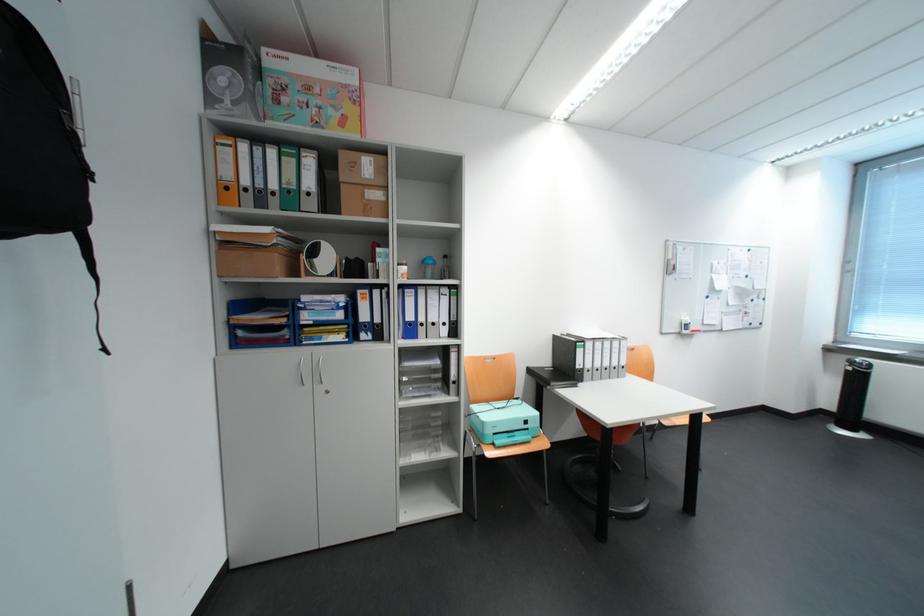
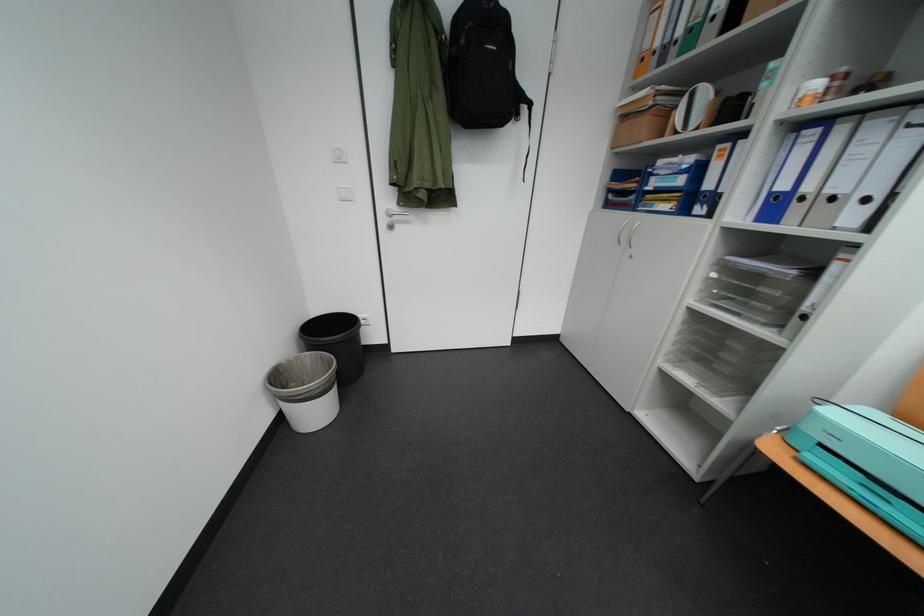
Locate, in the second image, the point that corresponds to point 417,323 in the first image.

(782, 196)